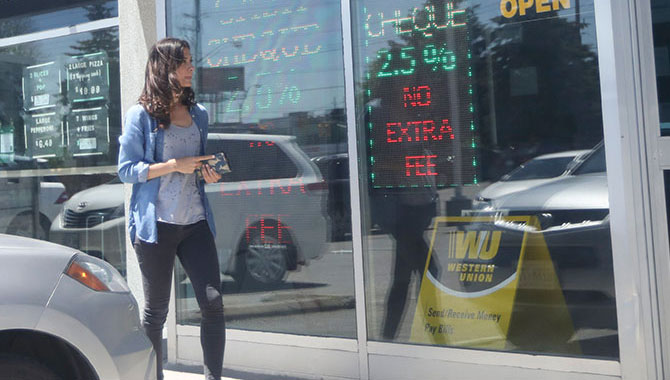
Locate an element on the screen. light up sign is located at coordinates (403, 64).